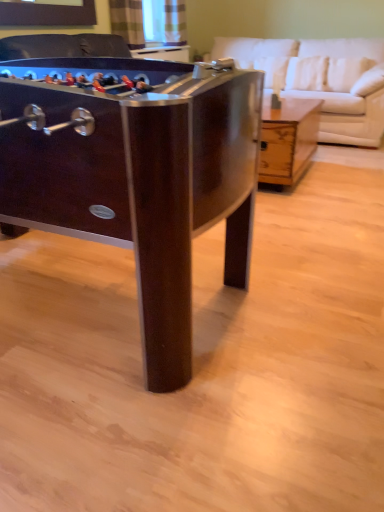
Question: Is wooden coffee table at center, which is counted as the 1th table, starting from the back, inside the boundaries of white leather couch at upper right, or outside?

Choices:
 (A) outside
 (B) inside

Answer: (A)

Question: In the image, is wooden coffee table at center, the 2th table viewed from the left, positioned in front of or behind white leather couch at upper right?

Choices:
 (A) front
 (B) behind

Answer: (A)

Question: Which object is the farthest from the dark wood foosball table at left, which ranks as the 2th table in back-to-front order?

Choices:
 (A) wooden coffee table at center, the 2th table viewed from the left
 (B) white leather couch at upper right

Answer: (B)

Question: Considering the real-world distances, which object is closest to the dark wood foosball table at left, the 1th table positioned from the front?

Choices:
 (A) white leather couch at upper right
 (B) wooden coffee table at center, the 2th table viewed from the left

Answer: (B)